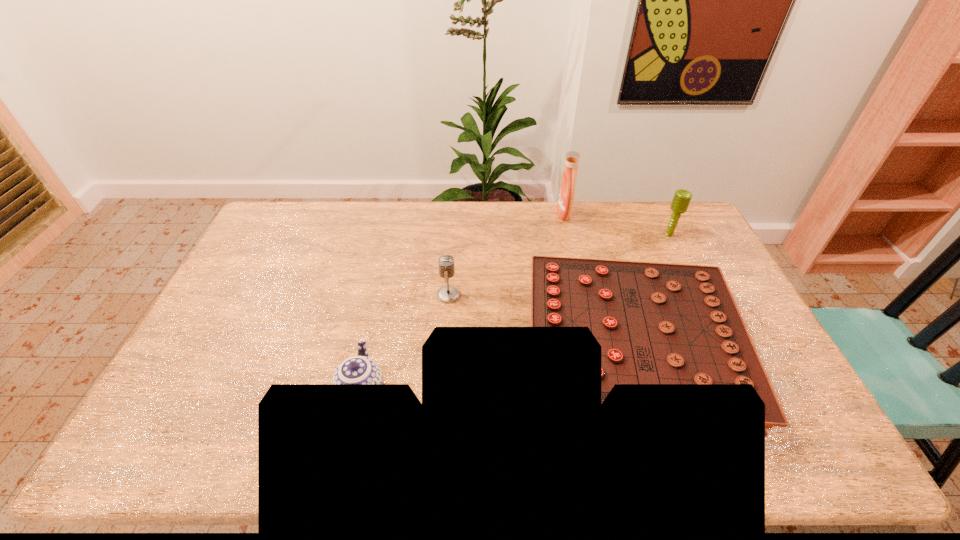
Locate an element on the screen. Image resolution: width=960 pixels, height=540 pixels. vacant area that lies between the chinaware and the gameboard is located at coordinates (495, 370).

Identify the location of free spot between the second object from left to right and the detergent. The height and width of the screenshot is (540, 960). (506, 254).

Find the location of `free space between the right microphone and the leftmost object`. free space between the right microphone and the leftmost object is located at coordinates (x=516, y=313).

The height and width of the screenshot is (540, 960). Find the location of `vacant area that lies between the farther microphone and the detergent`. vacant area that lies between the farther microphone and the detergent is located at coordinates (616, 224).

Identify the location of free space between the detergent and the chinaware. (463, 302).

The image size is (960, 540). I want to click on vacant point located between the farthest object and the chinaware, so click(463, 302).

Locate which object is the closest to the leftmost object. Please provide its 2D coordinates. Your answer should be formatted as a tuple, i.e. [(x, y)], where the tuple contains the x and y coordinates of a point satisfying the conditions above.

[(447, 294)]

Select which object appears as the closest to the nearer microphone. Please provide its 2D coordinates. Your answer should be formatted as a tuple, i.e. [(x, y)], where the tuple contains the x and y coordinates of a point satisfying the conditions above.

[(657, 323)]

Locate an element on the screen. The height and width of the screenshot is (540, 960). vacant space that satisfies the following two spatial constraints: 1. on the front side of the nearer microphone; 2. on the left side of the gameboard is located at coordinates (444, 349).

Find the location of a particular element. The height and width of the screenshot is (540, 960). vacant space that satisfies the following two spatial constraints: 1. at the spout of the left microphone; 2. on the right side of the leftmost object is located at coordinates (382, 295).